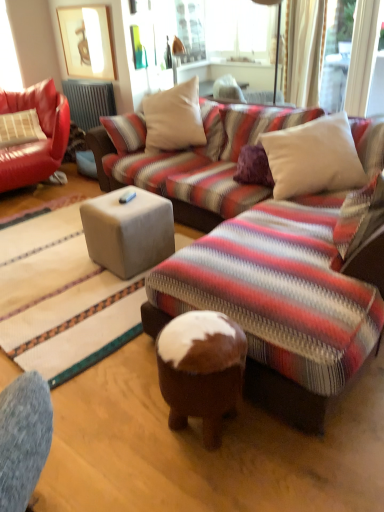
At what (x,y) coordinates should I click in order to perform the action: click on free point above suede-like beige cube at center (from a real-world perspective). Please return your answer as a coordinate pair (x, y). Looking at the image, I should click on (125, 196).